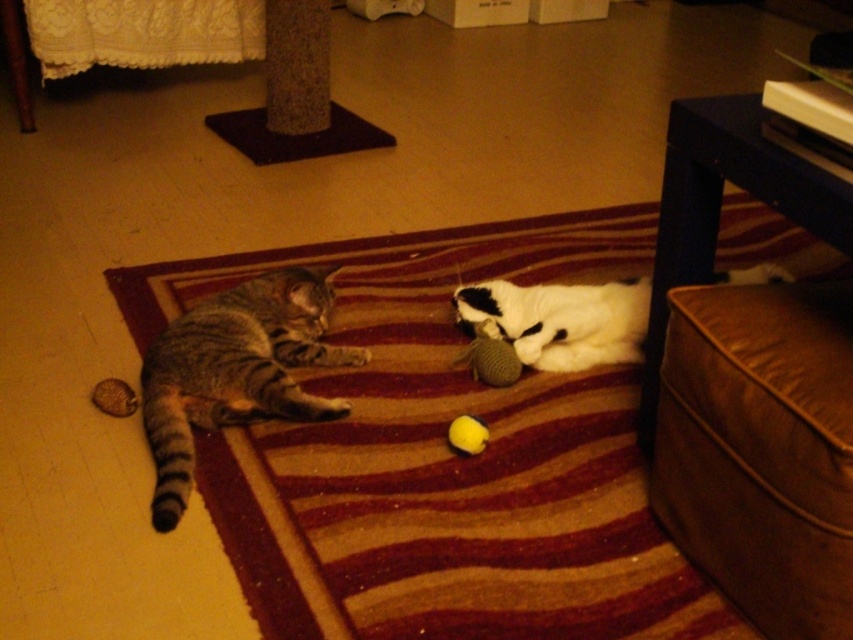
You are a GUI agent. You are given a task and a screenshot of the screen. Output one action in this format:
    pyautogui.click(x=<x>, y=<y>)
    Task: Click on the tabby fur cat at left
    This screenshot has height=640, width=853.
    Given the screenshot: What is the action you would take?
    pyautogui.click(x=235, y=371)

This screenshot has width=853, height=640. Describe the element at coordinates (235, 371) in the screenshot. I see `tabby fur cat at left` at that location.

This screenshot has width=853, height=640. Identify the location of tabby fur cat at left. (235, 371).

Can you confirm if striped carpet at center is positioned above soft brown plush ball at left?

Yes, striped carpet at center is above soft brown plush ball at left.

Is point (206, 269) less distant than point (91, 392)?

No.

The height and width of the screenshot is (640, 853). What are the coordinates of `striped carpet at center` in the screenshot? It's located at (444, 458).

Who is taller, brown leather ottoman at lower right or yellow rubber ball at center?

Standing taller between the two is brown leather ottoman at lower right.

Between brown leather ottoman at lower right and yellow rubber ball at center, which one appears on the left side from the viewer's perspective?

Positioned to the left is yellow rubber ball at center.

Is point (726, 538) more distant than point (486, 440)?

No.

Locate an element on the screen. The height and width of the screenshot is (640, 853). brown leather ottoman at lower right is located at coordinates (751, 384).